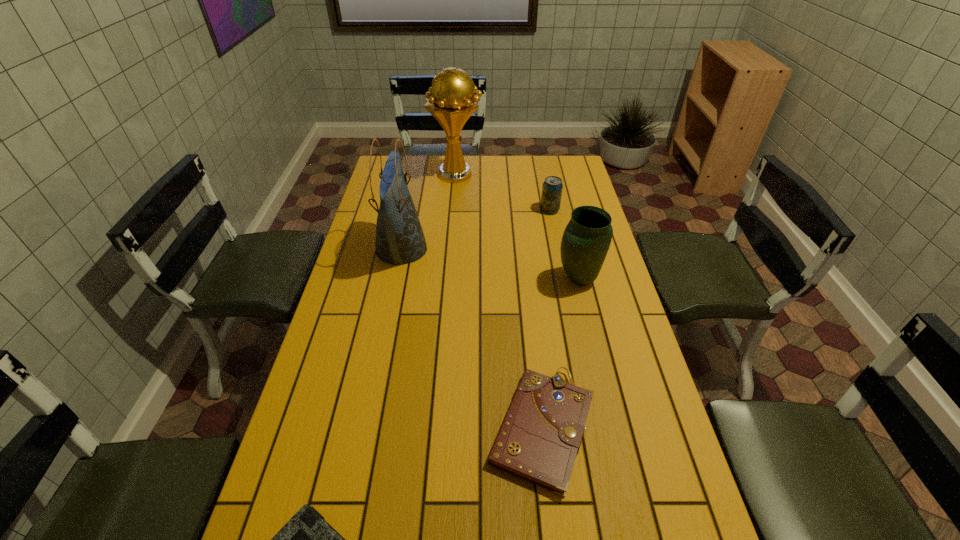
I want to click on trophy_cup, so click(452, 102).

The height and width of the screenshot is (540, 960). What are the coordinates of `shopping bag` in the screenshot? It's located at (400, 239).

Find the location of a particular element. This screenshot has width=960, height=540. vase is located at coordinates coord(587,237).

At what (x,y) coordinates should I click in order to perform the action: click on the fifth nearest object. Please return your answer as a coordinate pair (x, y). Looking at the image, I should click on (552, 187).

At what (x,y) coordinates should I click in order to perform the action: click on pop soda. Please return your answer as a coordinate pair (x, y). This screenshot has height=540, width=960. Looking at the image, I should click on (552, 187).

The image size is (960, 540). I want to click on the farther notebook, so click(539, 439).

Identify the location of the taller notebook. The image size is (960, 540). (539, 439).

Find the location of a particular element. free location located 0.110m at the front of the farthest object where the globe is prominent is located at coordinates (507, 174).

You are a GUI agent. You are given a task and a screenshot of the screen. Output one action in this format:
    pyautogui.click(x=<x>, y=<y>)
    Task: Click on the free spot located 0.210m on the back of the shopping bag
    The image size is (960, 540).
    Given the screenshot: What is the action you would take?
    pyautogui.click(x=413, y=195)

At what (x,y) coordinates should I click in order to perform the action: click on vacant space located 0.150m on the back of the vase. Please return your answer as a coordinate pair (x, y). This screenshot has height=540, width=960. Looking at the image, I should click on (569, 238).